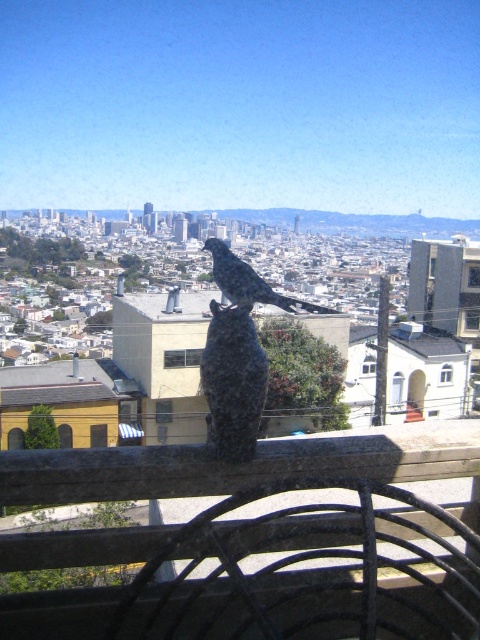
You are an architect designing a new sculpture garden. You have two statues available for placement in the center of the garden. The granite statue at center and the rustic stone bird at center. Based on their sizes, which statue would require a larger base to remain stable?

The rustic stone bird at center requires a larger base because it is bigger than the granite statue at center.

You are standing on a balcony overlooking the city and see the granite statue at center and the rustic stone bird at center. Which object is located to the right of the other?

The granite statue at center is positioned on the right side of rustic stone bird at center.

You are an architect planning to install a new light fixture. You need to know which object is located below the other between the granite statue at center and the rustic stone bird at center. Which one is situated lower?

The granite statue at center is positioned under rustic stone bird at center, so the granite statue at center is situated lower.